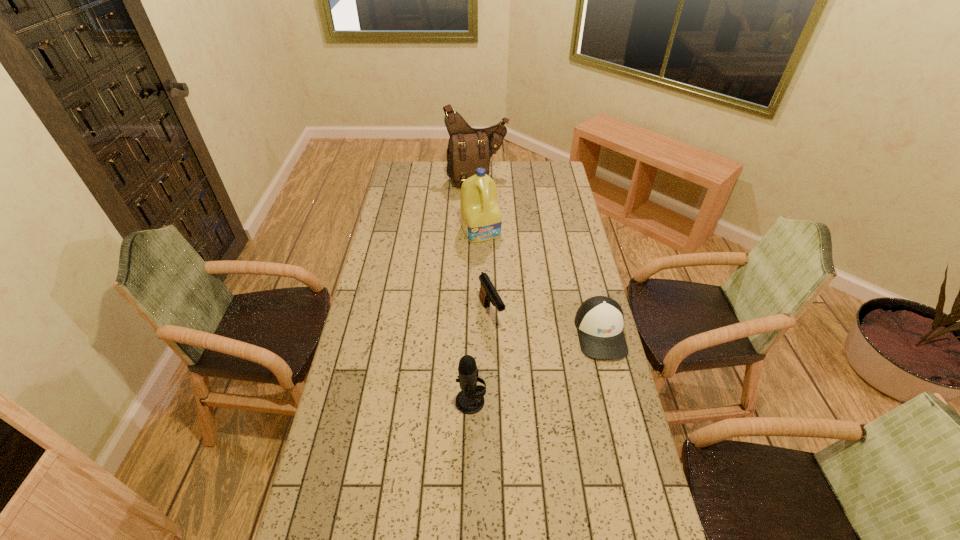
The image size is (960, 540). Find the location of `object that is positioned at the far edge`. object that is positioned at the far edge is located at coordinates (469, 148).

Identify the location of object that is at the right edge. The width and height of the screenshot is (960, 540). (599, 320).

The height and width of the screenshot is (540, 960). What are the coordinates of `free space at the near edge of the desktop` in the screenshot? It's located at (552, 528).

In the image, there is a desktop. Where is `vacant space at the left edge`? vacant space at the left edge is located at coordinates (419, 202).

In the image, there is a desktop. Identify the location of vacant space at the right edge. (589, 275).

The image size is (960, 540). Find the location of `blank region between the microphone and the farthest object`. blank region between the microphone and the farthest object is located at coordinates (474, 291).

Where is `empty space that is in between the farthest object and the pistol`? The height and width of the screenshot is (540, 960). empty space that is in between the farthest object and the pistol is located at coordinates [x=484, y=247].

Identify the location of free space that is in between the second shortest object and the shoulder bag. Image resolution: width=960 pixels, height=540 pixels. (484, 247).

This screenshot has width=960, height=540. In order to click on vacant space in between the rightmost object and the detergent in this screenshot , I will do `click(540, 282)`.

Image resolution: width=960 pixels, height=540 pixels. In order to click on vacant space in between the nearest object and the cap in this screenshot , I will do (x=536, y=367).